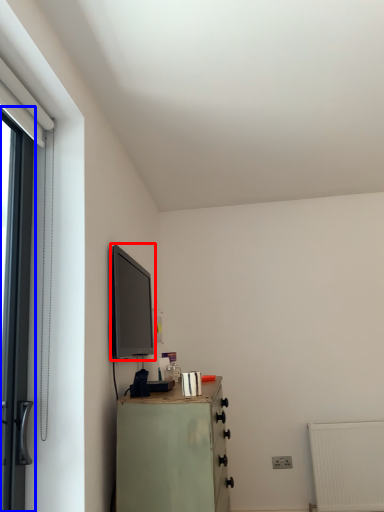
Question: Which of the following is the farthest to the observer, window screen (highlighted by a red box) or door (highlighted by a blue box)?

Choices:
 (A) window screen
 (B) door

Answer: (A)